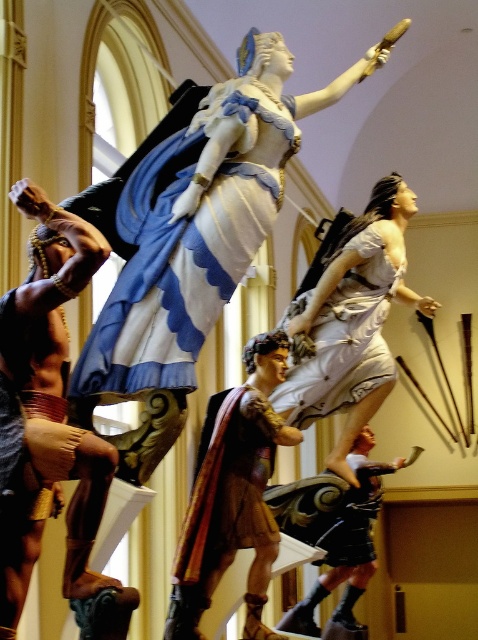
Question: Is polished bronze warrior at center positioned in front of velvet-like brown cape at center?

Choices:
 (A) no
 (B) yes

Answer: (A)

Question: Can you confirm if polished bronze warrior at center is wider than velvet-like fabric cape at center?

Choices:
 (A) yes
 (B) no

Answer: (A)

Question: Which point is farther to the camera?

Choices:
 (A) (368, 262)
 (B) (159, 378)
 (C) (337, 609)

Answer: (C)

Question: Estimate the real-world distances between objects in this image. Which object is closer to the velvet-like fabric cape at center?

Choices:
 (A) blue satin dress at center
 (B) white satin dress at center

Answer: (B)

Question: Can you confirm if blue satin dress at center is wider than polished bronze warrior at center?

Choices:
 (A) yes
 (B) no

Answer: (B)

Question: Which is farther from the white fabric dress at center?

Choices:
 (A) wooden figure at left
 (B) velvet-like brown cape at center
 (C) white satin dress at center
 (D) polished bronze warrior at center

Answer: (A)